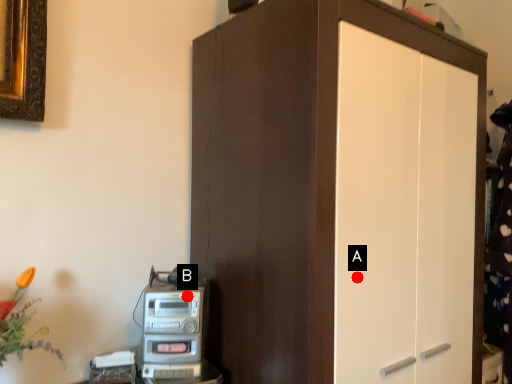
Question: Two points are circled on the image, labeled by A and B beside each circle. Which point is closer to the camera?

Choices:
 (A) A is closer
 (B) B is closer

Answer: (A)